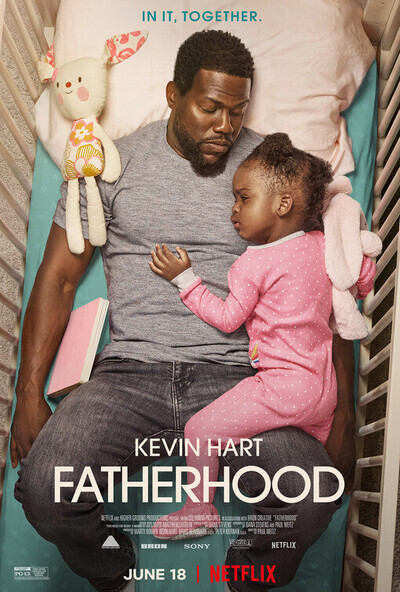
Find the location of a particular element. This screenshot has height=592, width=400. blue crib mattress is located at coordinates (360, 157), (42, 218), (96, 288), (21, 546), (318, 567).